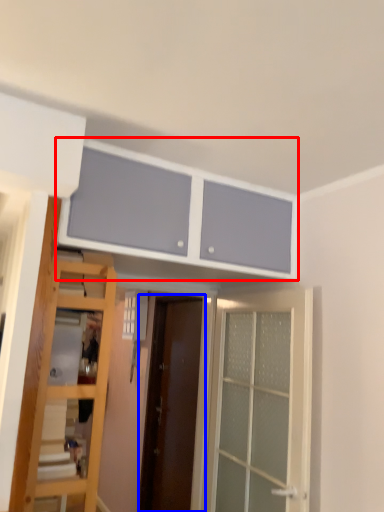
Question: Which point is further to the camera, cabinetry (highlighted by a red box) or door (highlighted by a blue box)?

Choices:
 (A) cabinetry
 (B) door

Answer: (B)